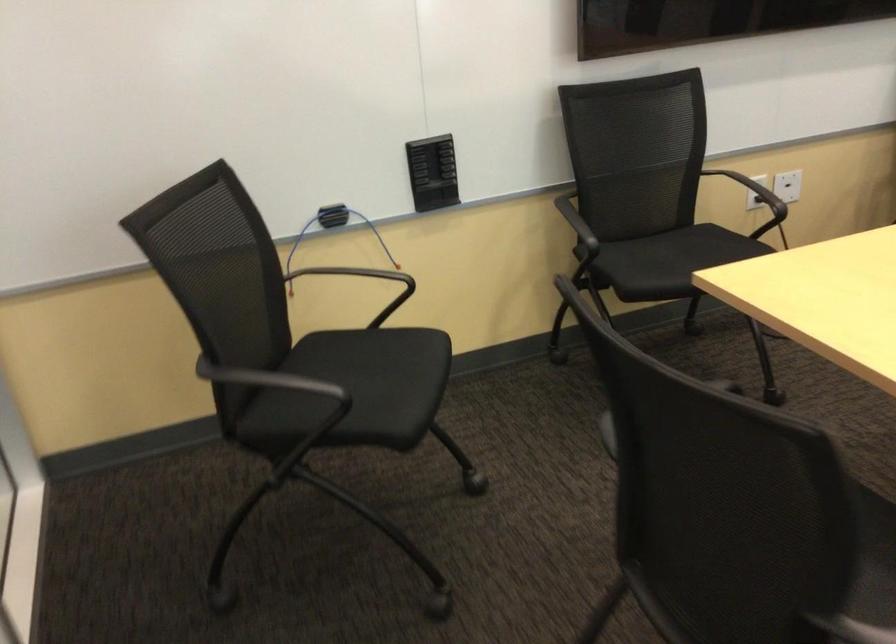
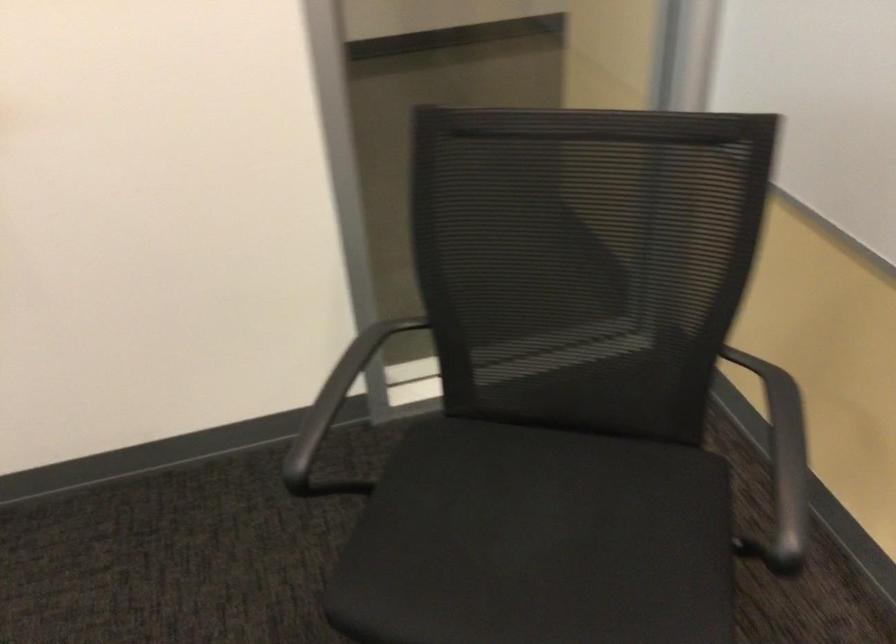
Where in the second image is the point corresponding to (x=364, y=379) from the first image?

(538, 542)